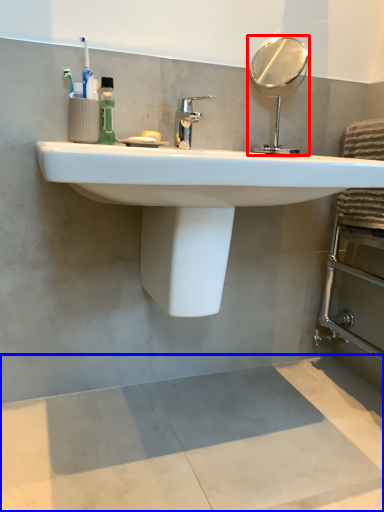
Question: Which object is further to the camera taking this photo, mirror (highlighted by a red box) or concrete (highlighted by a blue box)?

Choices:
 (A) mirror
 (B) concrete

Answer: (A)